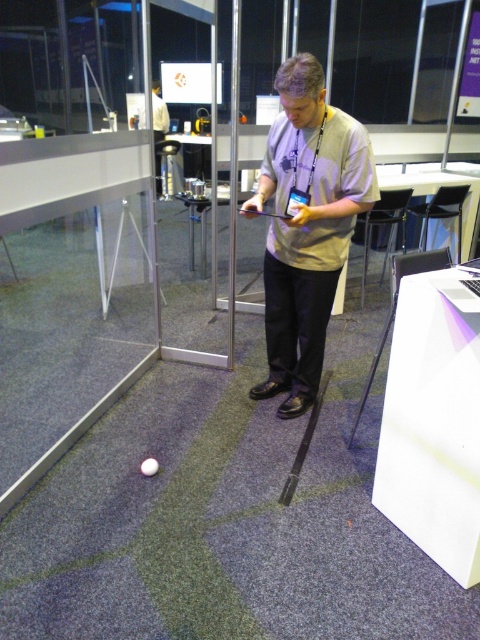
Is transparent glass door at center smaller than white matte ball at lower center?

Actually, transparent glass door at center might be larger than white matte ball at lower center.

Is transparent glass door at center to the right of white matte ball at lower center from the viewer's perspective?

Indeed, transparent glass door at center is positioned on the right side of white matte ball at lower center.

This screenshot has height=640, width=480. I want to click on transparent glass door at center, so click(x=228, y=218).

Between light gray cotton shirt at center and white matte ball at lower center, which one appears on the right side from the viewer's perspective?

light gray cotton shirt at center is more to the right.

Is point (347, 164) in front of point (143, 474)?

Yes, it is in front of point (143, 474).

Who is more distant from viewer, (x=291, y=243) or (x=149, y=461)?

The point (x=291, y=243) is more distant.

Locate an element on the screen. The width and height of the screenshot is (480, 640). light gray cotton shirt at center is located at coordinates (307, 225).

Between point (259, 196) and point (231, 113), which one is positioned behind?

Positioned behind is point (231, 113).

Between point (300, 237) and point (168, 4), which one is positioned in front?

Point (300, 237) is more forward.

You are a GUI agent. You are given a task and a screenshot of the screen. Output one action in this format:
    pyautogui.click(x=<x>, y=<y>)
    Task: Click on the light gray cotton shirt at center
    
    Given the screenshot: What is the action you would take?
    pyautogui.click(x=307, y=225)